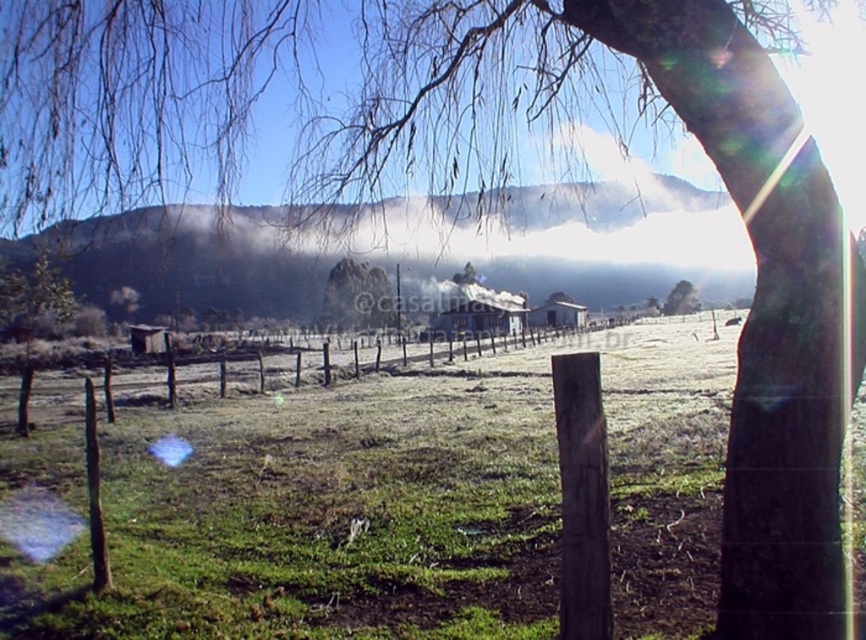
You are standing in the middle of the field and see the brown wooden fence at center and the smooth gray rock at center. Which object is nearer to you?

The brown wooden fence at center is closer to the viewer than the smooth gray rock at center, so the brown wooden fence at center is nearer to you.

Looking at this image, you are a painter setting up your easel in the middle of the field. You want to paint both the brown wooden fence at center and the smooth gray rock at center. Which object should you position closer to your easel to ensure it fits entirely within your painting frame without cropping?

The smooth gray rock at center should be positioned closer to your easel because it is narrower than the brown wooden fence at center, which is wider and would require more space in the painting frame.

You are standing at the center of the grassy field bordered by a wooden fence. You want to walk towards the green matte tree at left. Which direction should you face to head directly towards it?

You should face towards the left direction to head directly towards the green matte tree at left since it is located at the left side of the scene.